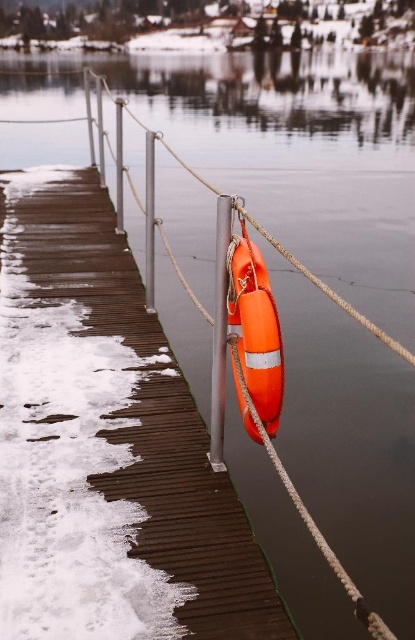
Question: Which point is closer to the camera?

Choices:
 (A) smooth gray pole at center
 (B) orange rubber lifebuoy at center

Answer: (A)

Question: Can you confirm if orange rubber lifebuoy at center is wider than smooth gray pole at center?

Choices:
 (A) no
 (B) yes

Answer: (B)

Question: Which point appears farthest from the camera in this image?

Choices:
 (A) (210, 436)
 (B) (256, 628)

Answer: (A)

Question: Is orange rubber lifebuoy at center to the right of smooth gray pole at center from the viewer's perspective?

Choices:
 (A) yes
 (B) no

Answer: (B)

Question: Is orange rubber lifebuoy at center above smooth gray pole at center?

Choices:
 (A) no
 (B) yes

Answer: (B)